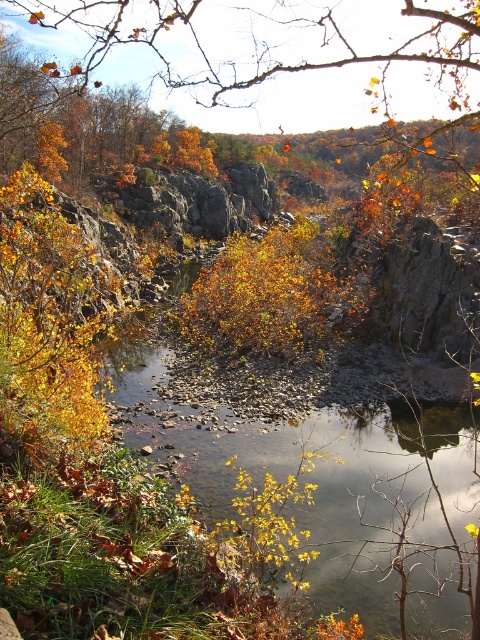
You are standing at the edge of the smooth rock river at center and want to take a photo of yourself using a selfie stick. The camera you are using has a maximum focus range of 10 feet. Will you be able to capture yourself clearly in the photo?

The distance between you and the smooth rock river at center is 13.83 feet, which exceeds the camera maximum focus range of 10 feet. Therefore, you won not be able to capture yourself clearly in the photo.

You are an explorer trying to cross the river. You see the smooth rock river at center and the orange leafy branch at upper center. Which object is closer to you as you stand at the riverbank?

The smooth rock river at center is closer to you than the orange leafy branch at upper center because it is positioned further away from the viewer.

You are standing at the edge of the river and see a point marked at coordinates (327, 483). Based on the scene description, where exactly is this point located?

The point at coordinates (327, 483) is located on the smooth rock river at center.